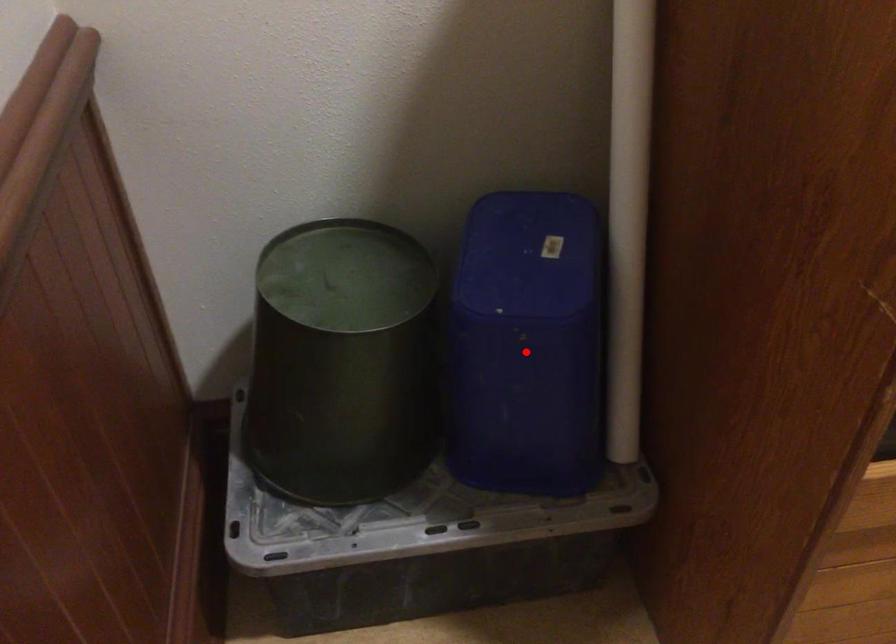
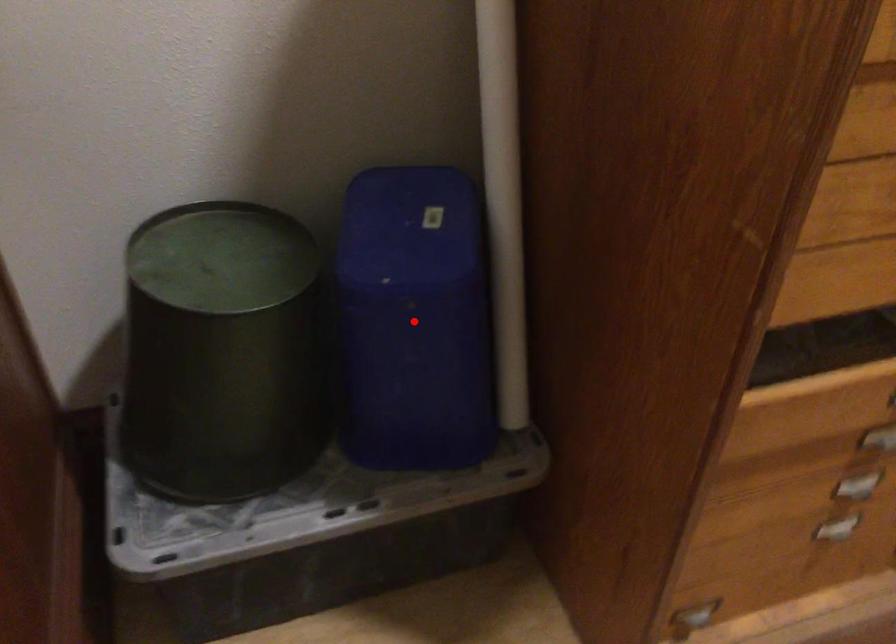
I am providing you with two images of the same scene from different viewpoints. A red point is marked on the first image and another point is marked on the second image. Are the points marked in image1 and image2 representing the same 3D position?

Yes